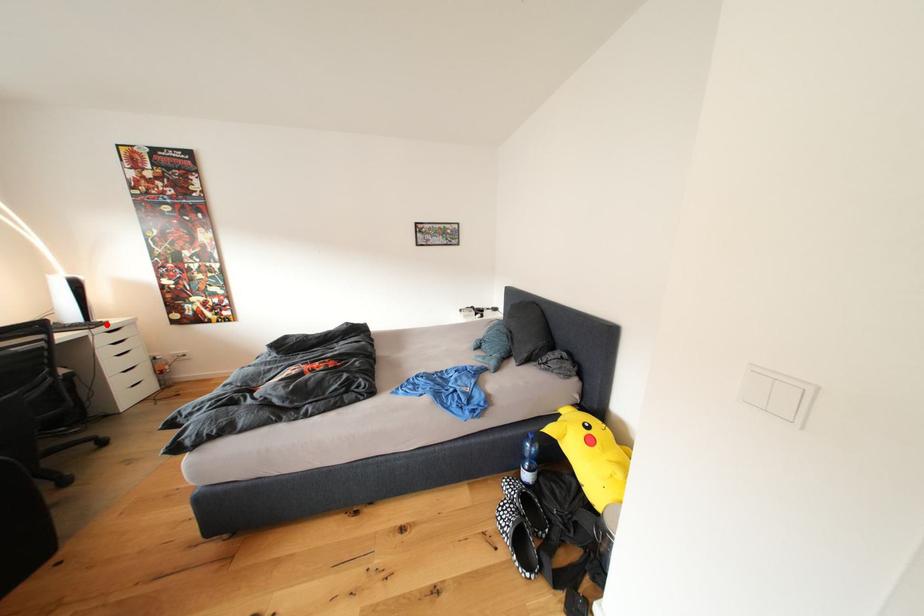
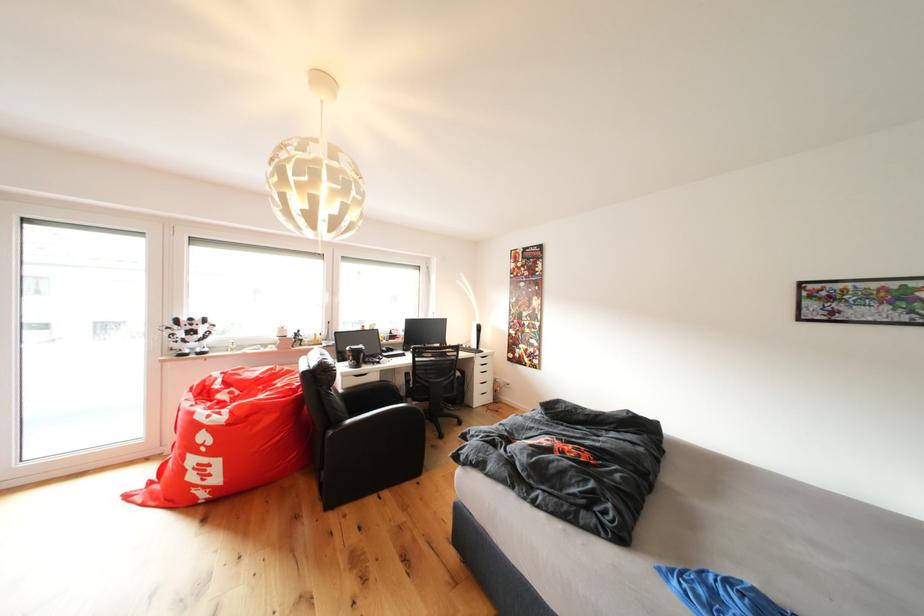
Find the pixel in the second image that matches the highlighted location in the first image.

(490, 354)